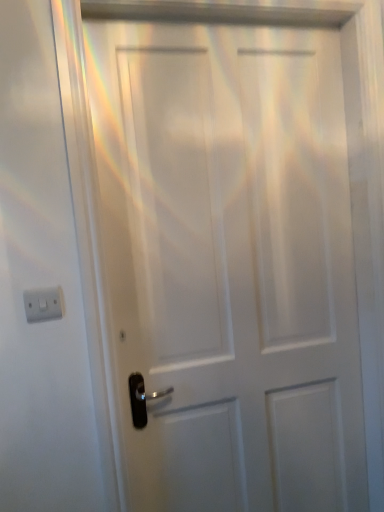
Question: Is white plastic light switch at left facing away from white matte door at center?

Choices:
 (A) yes
 (B) no

Answer: (B)

Question: Can you confirm if white plastic light switch at left is bigger than white matte door at center?

Choices:
 (A) yes
 (B) no

Answer: (B)

Question: Is white plastic light switch at left closer to the viewer compared to white matte door at center?

Choices:
 (A) no
 (B) yes

Answer: (B)

Question: From a real-world perspective, is white plastic light switch at left on white matte door at center?

Choices:
 (A) yes
 (B) no

Answer: (A)

Question: Considering the relative sizes of white plastic light switch at left and white matte door at center in the image provided, is white plastic light switch at left thinner than white matte door at center?

Choices:
 (A) yes
 (B) no

Answer: (A)

Question: Does white plastic light switch at left appear on the right side of white matte door at center?

Choices:
 (A) no
 (B) yes

Answer: (A)

Question: Is white matte door at center thinner than white plastic light switch at left?

Choices:
 (A) no
 (B) yes

Answer: (A)

Question: Is white matte door at center directly adjacent to white plastic light switch at left?

Choices:
 (A) no
 (B) yes

Answer: (A)

Question: From the image's perspective, would you say white matte door at center is shown under white plastic light switch at left?

Choices:
 (A) yes
 (B) no

Answer: (A)

Question: Considering the relative sizes of white matte door at center and white plastic light switch at left in the image provided, is white matte door at center bigger than white plastic light switch at left?

Choices:
 (A) no
 (B) yes

Answer: (B)

Question: Is white plastic light switch at left at the back of white matte door at center?

Choices:
 (A) yes
 (B) no

Answer: (B)

Question: Can you confirm if white matte door at center is taller than white plastic light switch at left?

Choices:
 (A) no
 (B) yes

Answer: (B)

Question: Considering their positions, is white plastic light switch at left located in front of or behind white matte door at center?

Choices:
 (A) front
 (B) behind

Answer: (A)